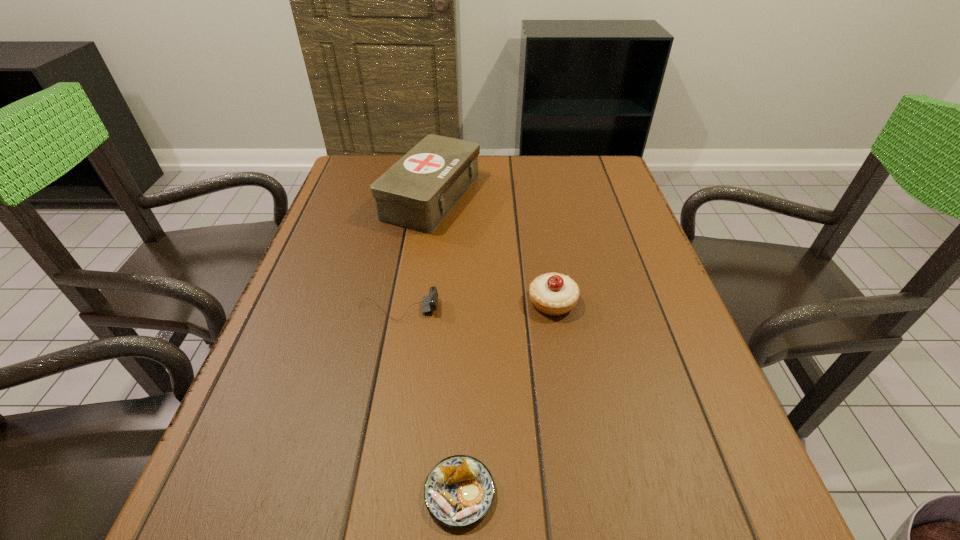
The image size is (960, 540). In order to click on the farthest object in this screenshot , I will do `click(419, 190)`.

Locate an element on the screen. The height and width of the screenshot is (540, 960). the tallest object is located at coordinates (419, 190).

The height and width of the screenshot is (540, 960). In order to click on the farther pastry in this screenshot , I will do `click(554, 294)`.

You are a GUI agent. You are given a task and a screenshot of the screen. Output one action in this format:
    pyautogui.click(x=<x>, y=<y>)
    Task: Click on the rightmost object
    The height and width of the screenshot is (540, 960).
    Given the screenshot: What is the action you would take?
    pyautogui.click(x=554, y=294)

The width and height of the screenshot is (960, 540). What are the coordinates of `webcam` in the screenshot? It's located at [429, 303].

I want to click on the shorter pastry, so click(459, 491).

You are a GUI agent. You are given a task and a screenshot of the screen. Output one action in this format:
    pyautogui.click(x=<x>, y=<y>)
    Task: Click on the nearest object
    This screenshot has width=960, height=540.
    Given the screenshot: What is the action you would take?
    pyautogui.click(x=459, y=491)

Locate an element on the screen. This screenshot has height=540, width=960. vacant point located on the left of the farthest object is located at coordinates point(331,197).

Find the location of `free spot located on the back of the rightmost object`. free spot located on the back of the rightmost object is located at coordinates (541, 237).

At what (x,y) coordinates should I click in order to perform the action: click on vacant space located on the front-facing side of the webcam. Please return your answer as a coordinate pair (x, y). The image size is (960, 540). Looking at the image, I should click on pos(618,309).